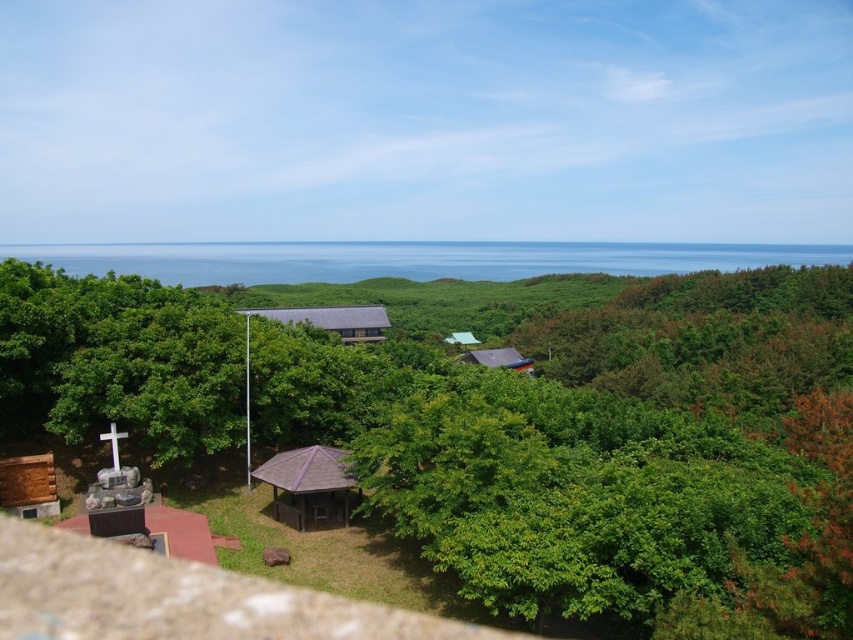
This screenshot has width=853, height=640. What do you see at coordinates (573, 432) in the screenshot?
I see `green leafy tree at center` at bounding box center [573, 432].

Does green leafy tree at center have a smaller size compared to wooden hut at center?

No.

Does point (779, 467) come behind point (352, 337)?

That is False.

Locate an element on the screen. This screenshot has width=853, height=640. green leafy tree at center is located at coordinates (573, 432).

Is wooden hut at center bigger than purple corrugated metal hut at center?

Correct, wooden hut at center is larger in size than purple corrugated metal hut at center.

Locate an element on the screen. The image size is (853, 640). wooden hut at center is located at coordinates (332, 320).

Does point (367, 314) come in front of point (479, 362)?

Yes, point (367, 314) is in front of point (479, 362).

Identify the location of wooden hut at center. (332, 320).

Between brown wooden hut at center and wooden hut at center, which one is positioned lower?

brown wooden hut at center is lower down.

Is point (263, 470) behind point (340, 316)?

That is False.

This screenshot has height=640, width=853. In order to click on brown wooden hut at center in this screenshot , I will do `click(310, 486)`.